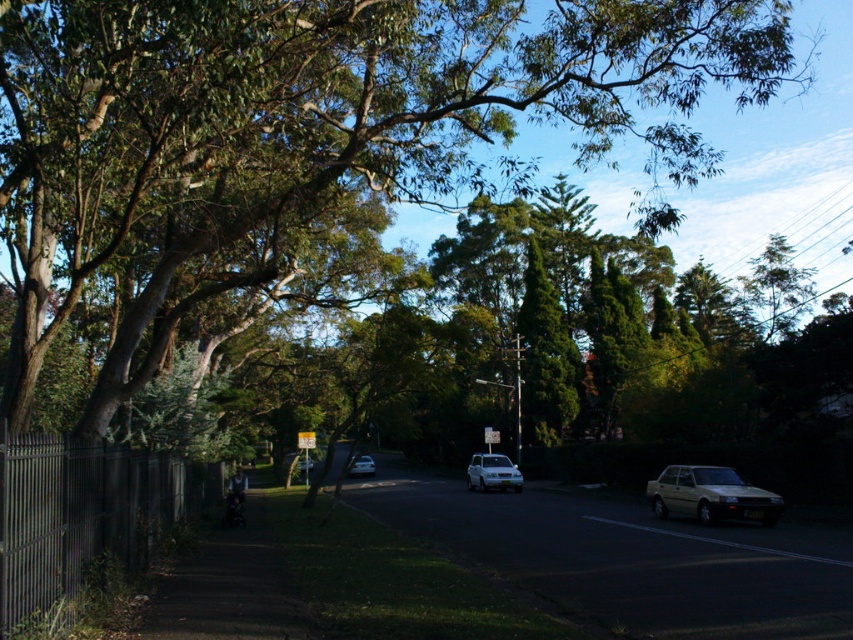
Is yellow plastic sign at center smaller than metallic rectangular sign at center?

Correct, yellow plastic sign at center occupies less space than metallic rectangular sign at center.

Does yellow plastic sign at center have a greater width compared to metallic rectangular sign at center?

No.

Between point (309, 449) and point (489, 442), which one is positioned behind?

Point (489, 442)

Locate an element on the screen. yellow plastic sign at center is located at coordinates (305, 440).

Does white matte car at center have a greater height compared to metallic rectangular sign at center?

Yes, white matte car at center is taller than metallic rectangular sign at center.

Does point (509, 472) lie in front of point (492, 435)?

Yes, it is.

You are a GUI agent. You are given a task and a screenshot of the screen. Output one action in this format:
    pyautogui.click(x=<x>, y=<y>)
    Task: Click on the white matte car at center
    
    Given the screenshot: What is the action you would take?
    pyautogui.click(x=492, y=474)

Measure the distance between white matte car at center and silver metallic sedan at center.

15.13 meters

Between white matte car at center and silver metallic sedan at center, which one is positioned higher?

white matte car at center is higher up.

Describe the element at coordinates (492, 474) in the screenshot. This screenshot has width=853, height=640. I see `white matte car at center` at that location.

Locate an element on the screen. white matte car at center is located at coordinates (492, 474).